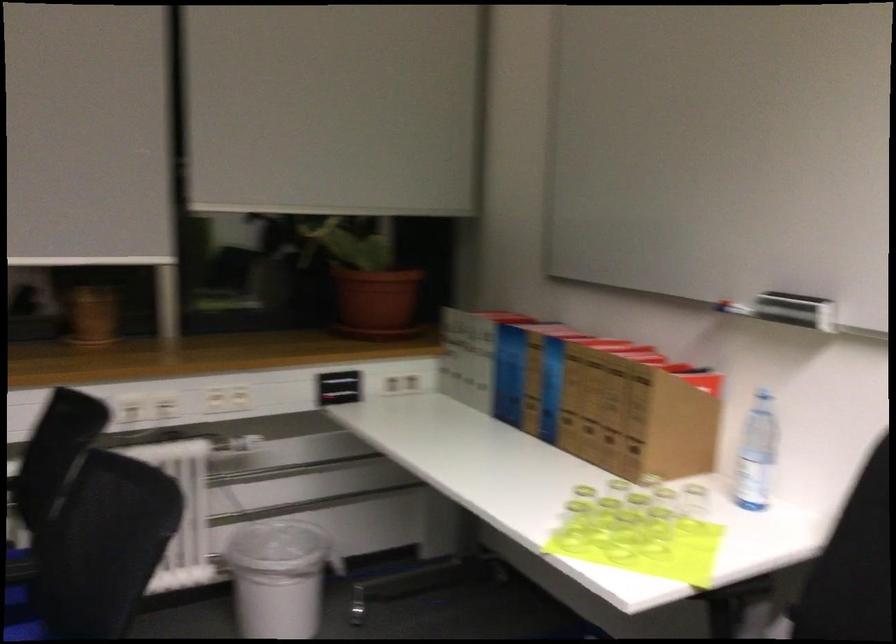
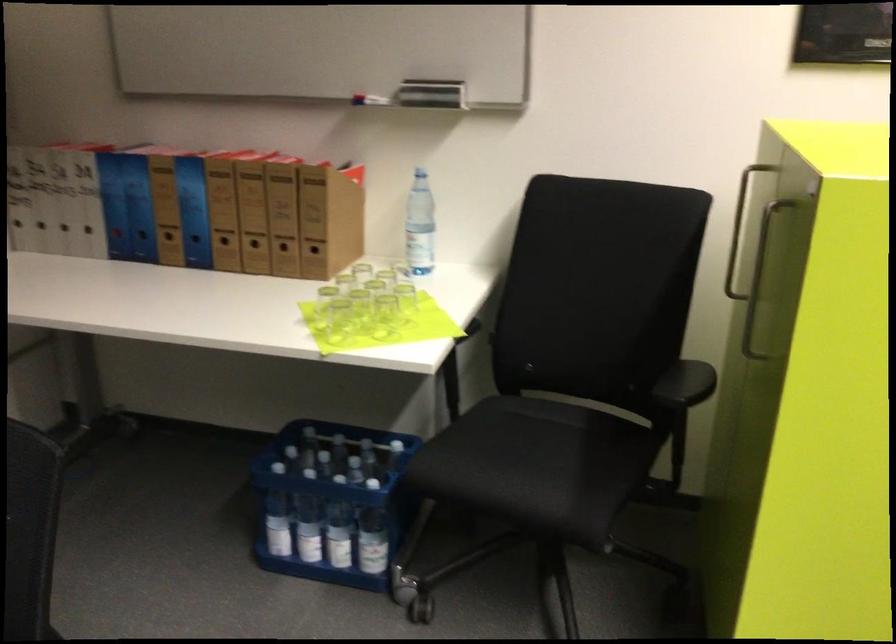
Where in the second image is the point corresponding to [565,422] from the first image?

(225, 245)